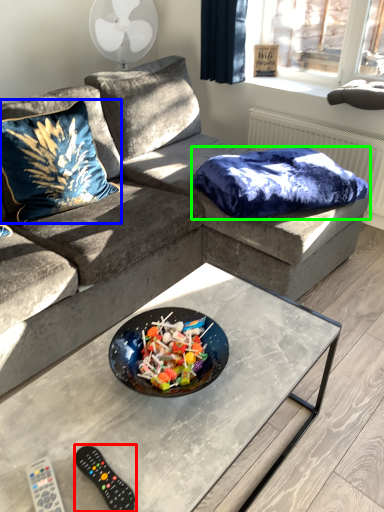
Question: Based on their relative distances, which object is farther from remote (highlighted by a red box)? Choose from throw pillow (highlighted by a blue box) and blanket (highlighted by a green box).

Choices:
 (A) throw pillow
 (B) blanket

Answer: (B)